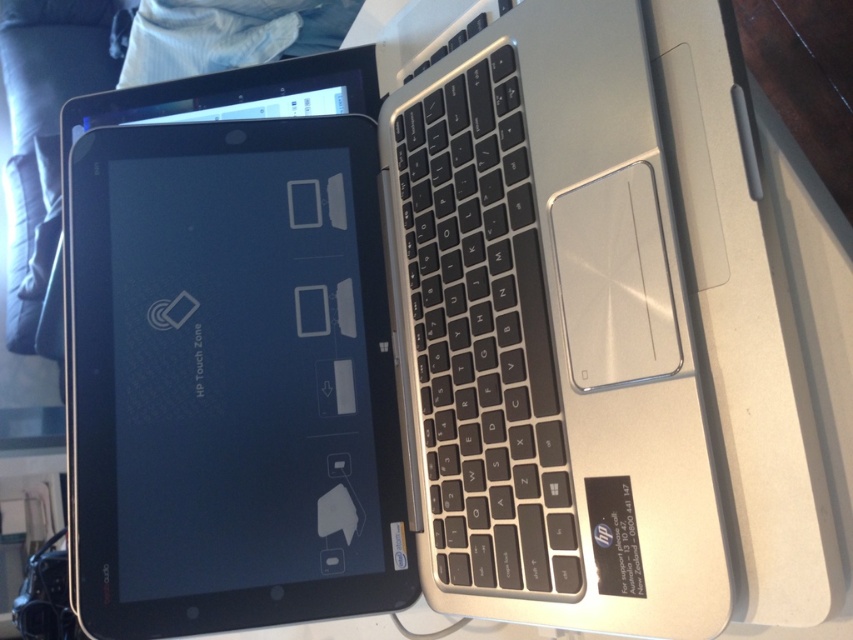
You are trying to locate the black glossy tablet at center in the image. According to the coordinates provided, where exactly is it positioned?

The black glossy tablet at center is located at point coordinates of 0.594 on the x axis and 0.272 on the y axis.

You are trying to place a 6.5 inch long ruler between the black glossy tablet at center and the black matte keyboard at center. Can the ruler fit exactly between them without overlapping either object?

The distance between the black glossy tablet at center and the black matte keyboard at center is 6.53 inches. Since the ruler is 6.5 inches long, it can fit exactly between them with a small gap of 0.03 inches remaining.